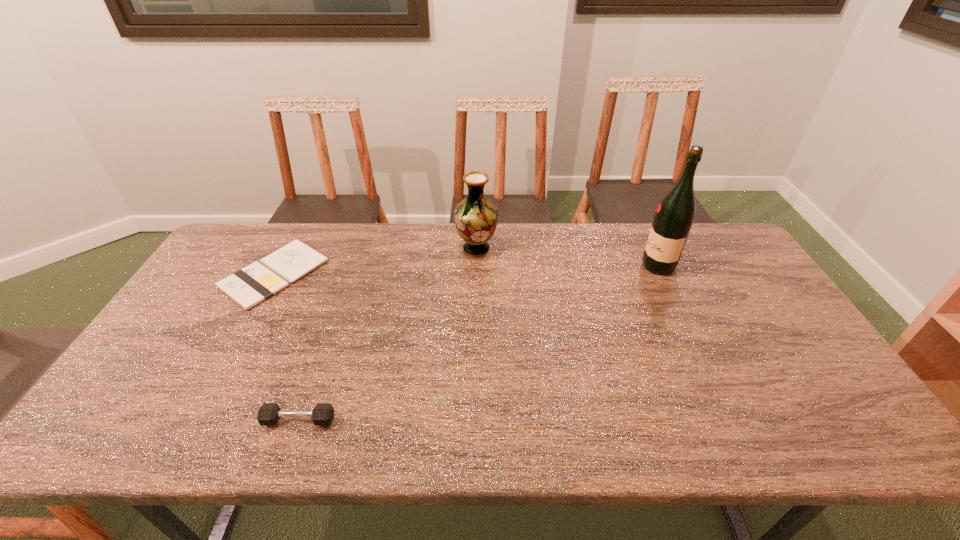
You are a GUI agent. You are given a task and a screenshot of the screen. Output one action in this format:
    pyautogui.click(x=<x>, y=<y>)
    Task: Click on the vacant space that's between the third object from left to right and the second shortest object
    This screenshot has height=540, width=960.
    Given the screenshot: What is the action you would take?
    pyautogui.click(x=387, y=334)

Find the location of a particular element. This screenshot has height=540, width=960. free area in between the notepad and the nearest object is located at coordinates (286, 347).

Find the location of a particular element. vacant space that is in between the second object from right to left and the dumbbell is located at coordinates (387, 334).

Identify which object is located as the second nearest to the shortest object. Please provide its 2D coordinates. Your answer should be formatted as a tuple, i.e. [(x, y)], where the tuple contains the x and y coordinates of a point satisfying the conditions above.

[(476, 217)]

The width and height of the screenshot is (960, 540). Identify the location of object that is the third closest one to the rightmost object. (248, 287).

You are a GUI agent. You are given a task and a screenshot of the screen. Output one action in this format:
    pyautogui.click(x=<x>, y=<y>)
    Task: Click on the vacant space that satisfies the following two spatial constraints: 1. on the front side of the third tallest object; 2. on the left side of the notepad
    The image size is (960, 540).
    Given the screenshot: What is the action you would take?
    pyautogui.click(x=196, y=420)

The width and height of the screenshot is (960, 540). I want to click on free space that satisfies the following two spatial constraints: 1. on the front-facing side of the liquor; 2. on the front side of the dumbbell, so click(732, 420).

Locate an element on the screen. vacant point that satisfies the following two spatial constraints: 1. on the back side of the vase; 2. on the right side of the shortest object is located at coordinates (288, 249).